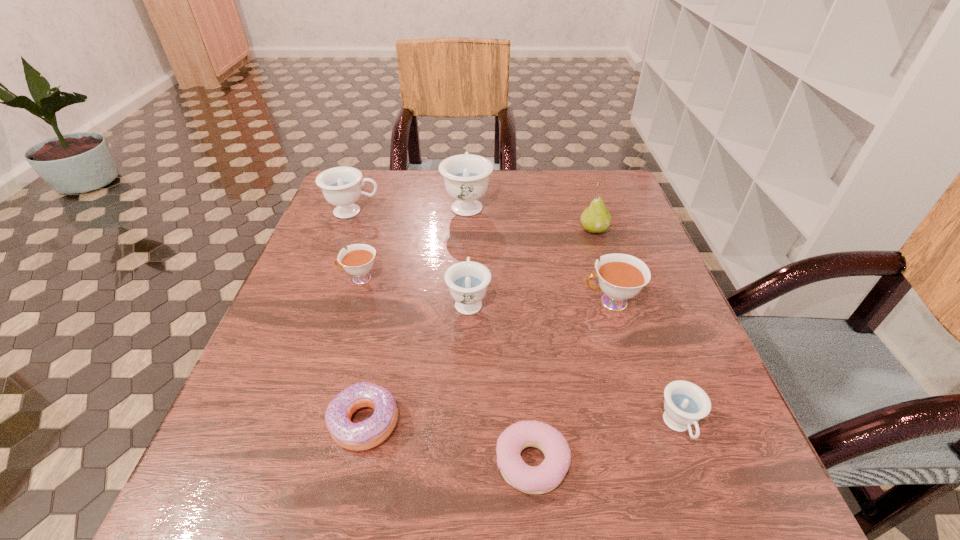
Find the location of `vacant region between the second smallest blue teacup and the biggest blue teacup`. vacant region between the second smallest blue teacup and the biggest blue teacup is located at coordinates (468, 252).

Locate an element on the screen. The width and height of the screenshot is (960, 540). vacant space in between the bigger white teacup and the left purple doughnut is located at coordinates (487, 362).

Find the location of a particular element. The image size is (960, 540). empty space that is in between the second biggest blue teacup and the nearest blue teacup is located at coordinates (516, 319).

Find the location of a particular element. object that stands as the fourth closest to the leftmost blue teacup is located at coordinates (371, 432).

Where is `the second closest object to the tallest teacup`? The width and height of the screenshot is (960, 540). the second closest object to the tallest teacup is located at coordinates (358, 260).

Locate which teacup is the fourth closest to the smallest blue teacup. Please provide its 2D coordinates. Your answer should be formatted as a tuple, i.e. [(x, y)], where the tuple contains the x and y coordinates of a point satisfying the conditions above.

[(466, 176)]

The image size is (960, 540). I want to click on teacup that is the fifth nearest to the bigger white teacup, so click(341, 187).

The height and width of the screenshot is (540, 960). I want to click on blue teacup that is the closest one to the green pear, so click(x=466, y=176).

Where is `blue teacup that is the third closest to the right doughnut`? The image size is (960, 540). blue teacup that is the third closest to the right doughnut is located at coordinates (466, 176).

At what (x,y) coordinates should I click in order to perform the action: click on blank area in the image that satisfies the following two spatial constraints: 1. on the side of the green pear with the handle; 2. on the right side of the leftmost blue teacup. Please return your answer as a coordinate pair (x, y). Looking at the image, I should click on (347, 229).